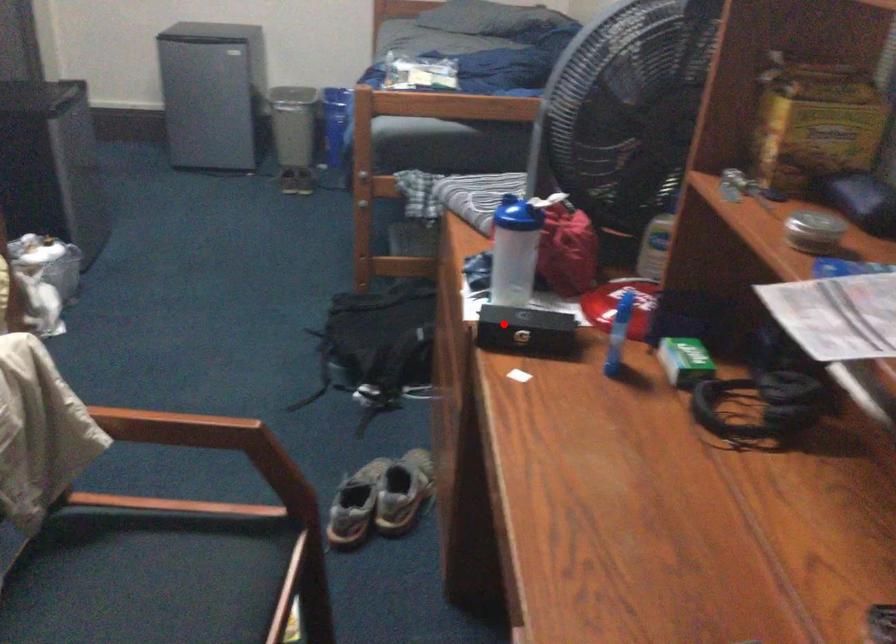
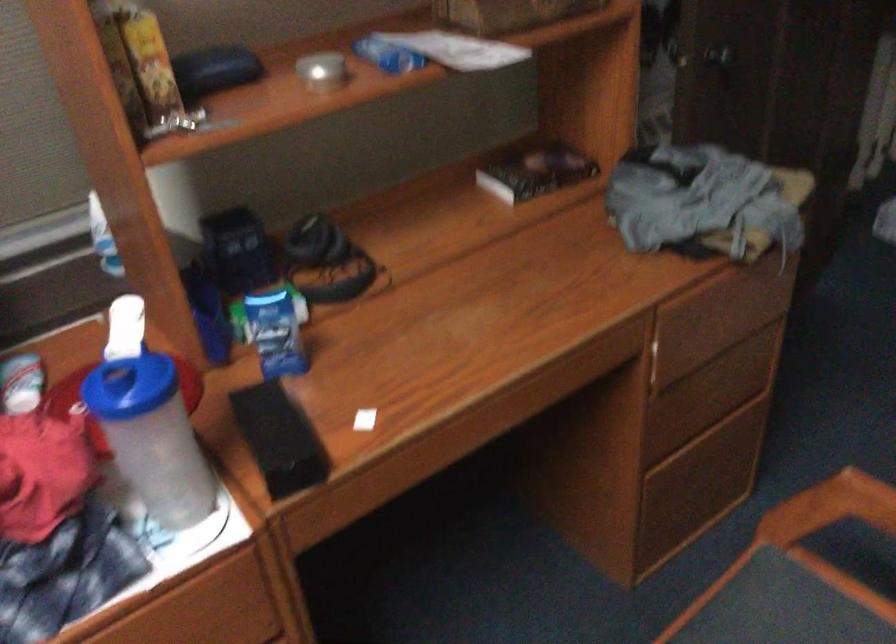
Question: A red point is marked in image1. In image2, is the corresponding 3D point closer to the camera or farther? Reply with the corresponding letter.

Choices:
 (A) The corresponding 3D point is closer.
 (B) The corresponding 3D point is farther.

Answer: (A)